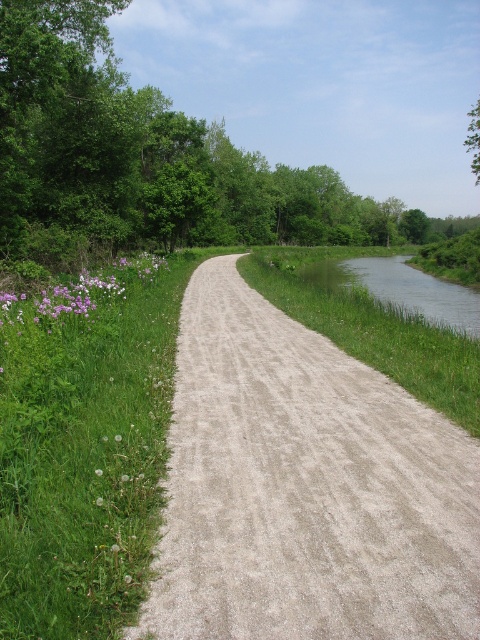
Which is in front, point (354, 579) or point (468, 118)?

Positioned in front is point (354, 579).

Can you confirm if gray gravel path at center is taller than green leafy tree at upper right?

In fact, gray gravel path at center may be shorter than green leafy tree at upper right.

Does point (370, 582) lie in front of point (476, 145)?

Yes, it is.

The width and height of the screenshot is (480, 640). Find the location of `gray gravel path at center`. gray gravel path at center is located at coordinates (304, 486).

Is green grass at left to the left of clear water at right from the viewer's perspective?

Correct, you'll find green grass at left to the left of clear water at right.

Describe the element at coordinates (84, 452) in the screenshot. I see `green grass at left` at that location.

The width and height of the screenshot is (480, 640). What are the coordinates of `green grass at left` in the screenshot? It's located at (84, 452).

Is clear water at right below green leafy tree at upper right?

Correct, clear water at right is located below green leafy tree at upper right.

Measure the distance between clear water at right and green leafy tree at upper right.

The distance of clear water at right from green leafy tree at upper right is 520.87 feet.

In the scene shown: Who is more forward, (x=339, y=280) or (x=474, y=156)?

Positioned in front is point (x=339, y=280).

In order to click on clear water at right in this screenshot , I will do `click(403, 289)`.